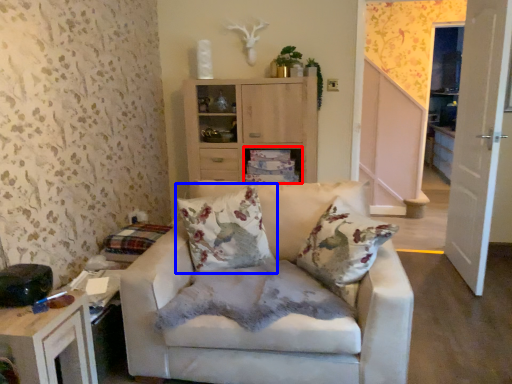
Question: Among these objects, which one is nearest to the camera, shelf (highlighted by a red box) or pillow (highlighted by a blue box)?

Choices:
 (A) shelf
 (B) pillow

Answer: (B)